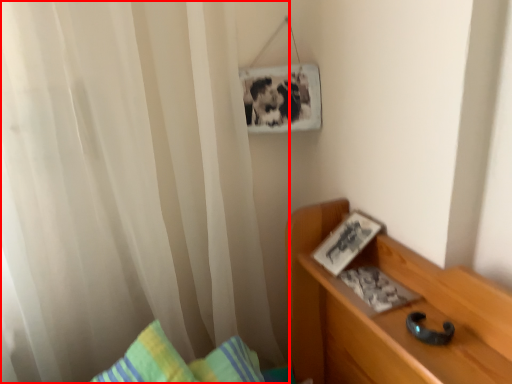
Question: In this image, where is curtain (annotated by the red box) located relative to book?

Choices:
 (A) right
 (B) left

Answer: (B)